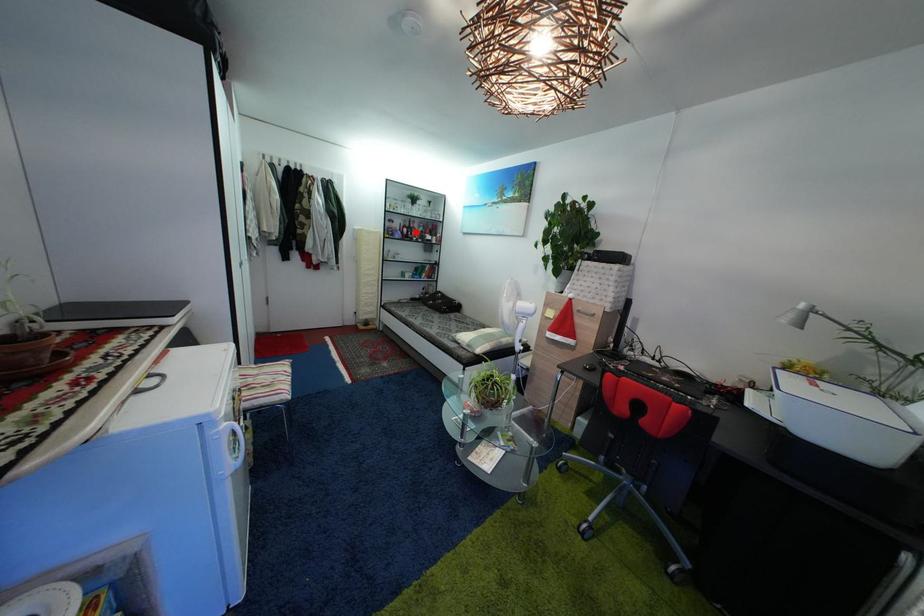
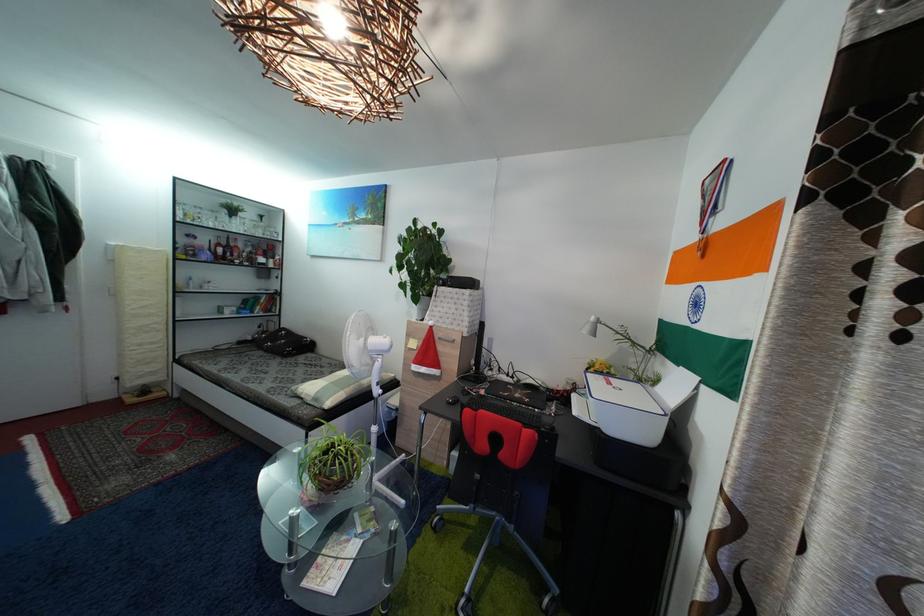
Where in the second image is the point corresponding to the highlighted location from the first image?

(233, 251)